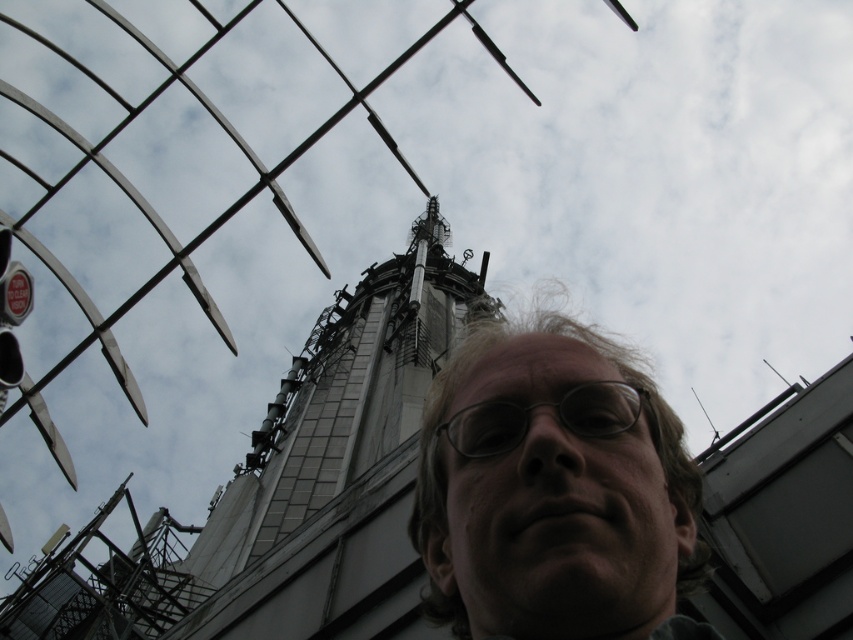
You are a photographer trying to capture the silver metallic tower at center without the clear plastic glasses at center blocking the view. Based on their sizes, is it possible to adjust your position so that the tower is fully visible without any obstruction from the glasses?

The silver metallic tower at center is wider than the clear plastic glasses at center, so it is possible to adjust your position to ensure the tower is fully visible without obstruction from the glasses.

You are standing at the base of the tower and looking up at the two points marked on the tower. Which point is closer to you, point 1 at coordinates [556,618] or point 2 at coordinates [494,417]?

Point 1 at coordinates [556,618] is closer to you than point 2 at coordinates [494,417].

You are a photographer trying to capture a closeup of the clear plastic glasses at center while also including the light brown hair at center in the frame. Which object should you adjust your focus to ensure both are in the frame?

The light brown hair at center is bigger than clear plastic glasses at center, so you should focus on the light brown hair at center to ensure both are in the frame.